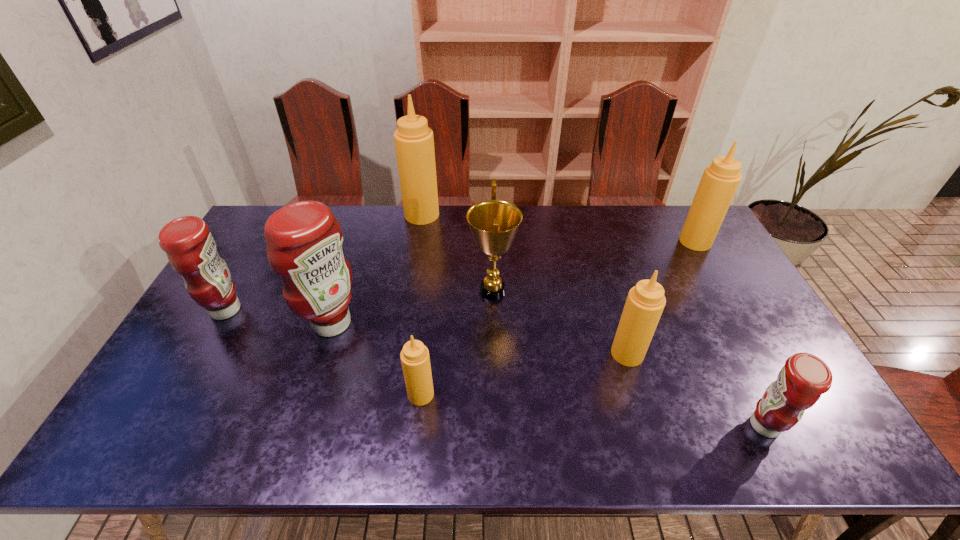
At what (x,y) coordinates should I click in order to perform the action: click on the farthest condiment. Please return your answer as a coordinate pair (x, y). Image resolution: width=960 pixels, height=540 pixels. Looking at the image, I should click on (x=414, y=143).

This screenshot has height=540, width=960. Find the location of `the biggest tan condiment`. the biggest tan condiment is located at coordinates (414, 143).

The height and width of the screenshot is (540, 960). Identify the location of the rightmost tan condiment. (720, 180).

Locate an element on the screen. Image resolution: width=960 pixels, height=540 pixels. the second farthest condiment is located at coordinates (720, 180).

I want to click on the second red condiment from right to left, so click(x=304, y=240).

You are a GUI agent. You are given a task and a screenshot of the screen. Output one action in this format:
    pyautogui.click(x=<x>, y=<y>)
    Task: Click on the sixth condiment from right to left
    
    Given the screenshot: What is the action you would take?
    pyautogui.click(x=304, y=240)

Identify the location of award. (494, 223).

I want to click on gold award, so click(x=494, y=223).

Identify the location of the second tan condiment from right to left. This screenshot has height=540, width=960. (645, 302).

Identify the location of the third condiment from right to left. The width and height of the screenshot is (960, 540). (645, 302).